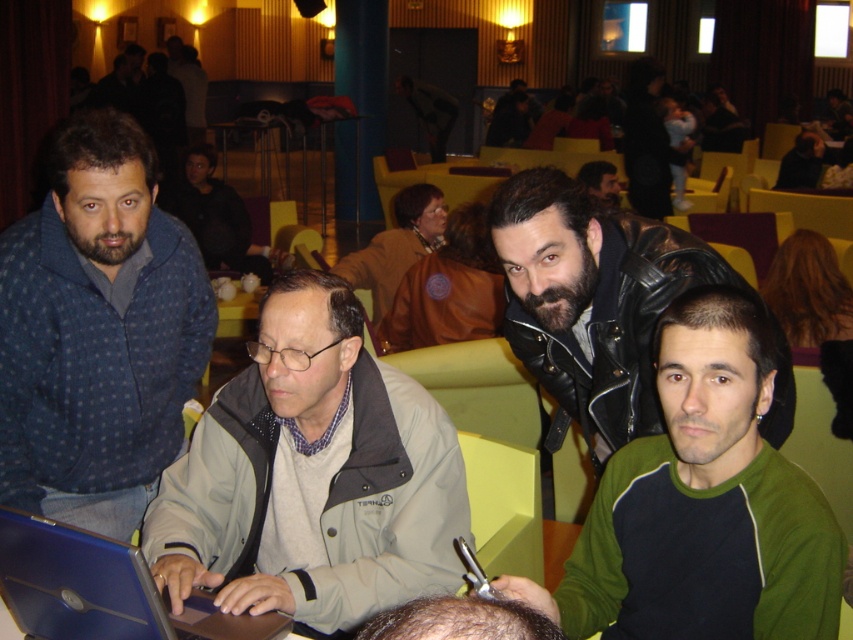
Question: Which object is positioned farthest from the brown leather jacket at center?

Choices:
 (A) green fleece at center
 (B) leather jacket at center
 (C) blue matte laptop at center

Answer: (C)

Question: Among these objects, which one is farthest from the camera?

Choices:
 (A) brown leather jacket at center
 (B) gray fabric jacket at center

Answer: (A)

Question: Is green fleece at center behind blue matte laptop at center?

Choices:
 (A) no
 (B) yes

Answer: (B)

Question: Does blue dotted sweater at left appear on the left side of blue matte laptop at center?

Choices:
 (A) no
 (B) yes

Answer: (B)

Question: Can you confirm if green fleece at center is positioned to the left of blue matte laptop at center?

Choices:
 (A) yes
 (B) no

Answer: (B)

Question: Which is farther from the gray fabric jacket at center?

Choices:
 (A) blue matte laptop at center
 (B) green fleece at center
 (C) blue dotted sweater at left
 (D) leather jacket at center

Answer: (B)